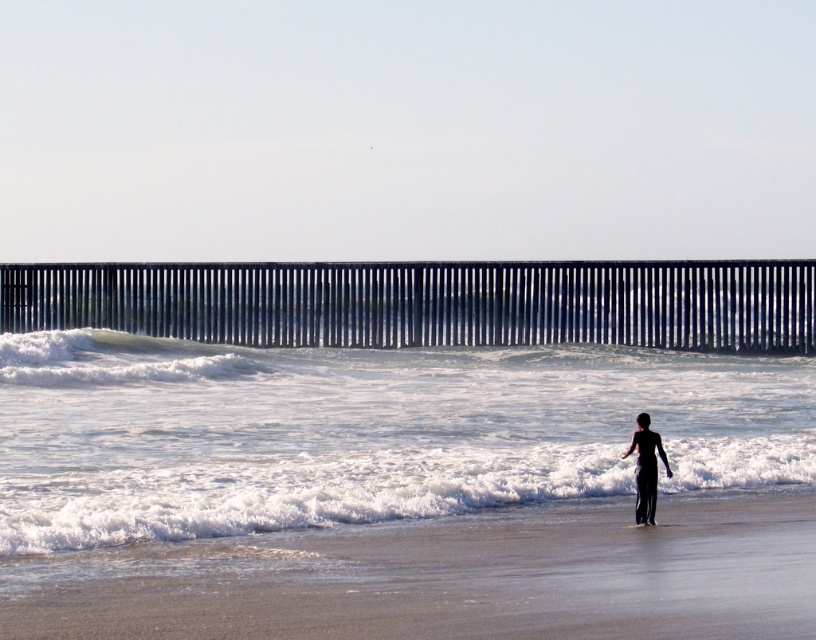
Question: Can you confirm if white frothy water at center is positioned to the right of white foamy wave at center?

Choices:
 (A) yes
 (B) no

Answer: (A)

Question: Among these objects, which one is farthest from the camera?

Choices:
 (A) white foamy wave at center
 (B) white foam surfboard at lower center
 (C) black matte wetsuit at center
 (D) white frothy water at center

Answer: (A)

Question: In this image, where is white foamy wave at center located relative to black matte wetsuit at center?

Choices:
 (A) right
 (B) left

Answer: (B)

Question: In this image, where is white frothy water at center located relative to black matte wetsuit at center?

Choices:
 (A) above
 (B) below

Answer: (A)

Question: Which point is closer to the camera?

Choices:
 (A) white foam surfboard at lower center
 (B) sandy beach at lower center

Answer: (B)

Question: Which object is farther from the camera taking this photo?

Choices:
 (A) white foamy wave at center
 (B) white frothy water at center

Answer: (A)